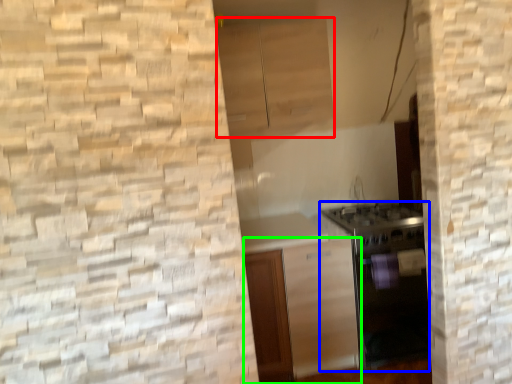
Question: Considering the real-world distances, which object is farthest from cabinetry (highlighted by a red box)? oven (highlighted by a blue box) or cabinetry (highlighted by a green box)?

Choices:
 (A) oven
 (B) cabinetry

Answer: (B)